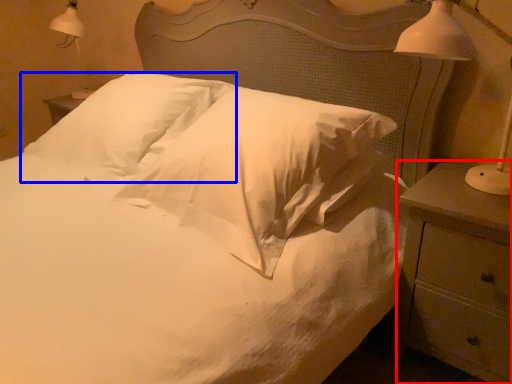
Question: Which point is closer to the camera, nightstand (highlighted by a red box) or pillow (highlighted by a blue box)?

Choices:
 (A) nightstand
 (B) pillow

Answer: (A)